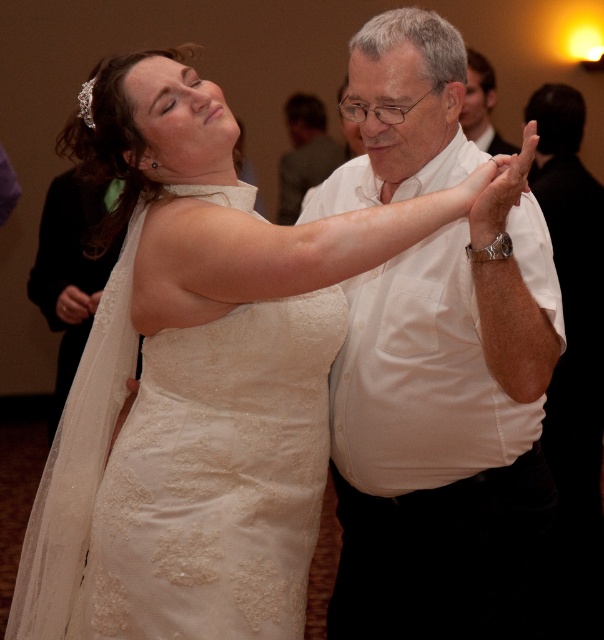
Question: Does lace fabric dress at center appear under white shirt at upper center?

Choices:
 (A) no
 (B) yes

Answer: (B)

Question: Considering the real-world distances, which object is farthest from the white cotton shirt at center?

Choices:
 (A) lace fabric dress at center
 (B) white shirt at center
 (C) white shirt at upper center

Answer: (B)

Question: Based on their relative distances, which object is nearer to the white shirt at upper center?

Choices:
 (A) white shirt at center
 (B) white cotton shirt at center
 (C) lace fabric dress at center

Answer: (A)

Question: Estimate the real-world distances between objects in this image. Which object is farther from the white shirt at center?

Choices:
 (A) white shirt at upper center
 (B) lace fabric dress at center
 (C) white cotton shirt at center

Answer: (B)

Question: Is white cotton shirt at center above white shirt at upper center?

Choices:
 (A) yes
 (B) no

Answer: (B)

Question: Is lace fabric dress at center closer to the viewer compared to white shirt at upper center?

Choices:
 (A) no
 (B) yes

Answer: (B)